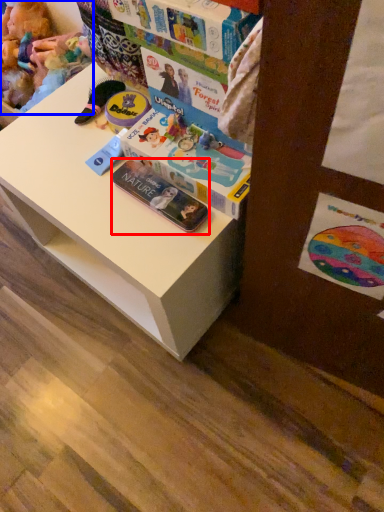
Question: Which point is further to the camera, paperback book (highlighted by a red box) or toy (highlighted by a blue box)?

Choices:
 (A) paperback book
 (B) toy

Answer: (B)